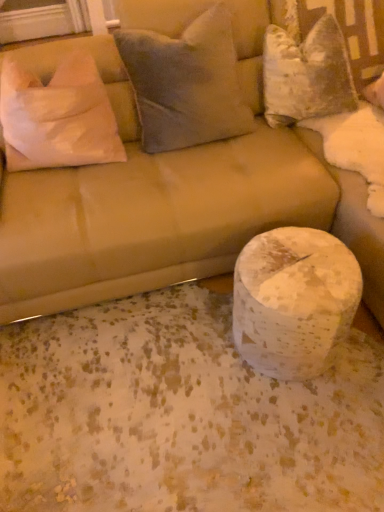
This screenshot has height=512, width=384. I want to click on white fabric pillow at left, marked as the third pillow in a right-to-left arrangement, so click(x=58, y=116).

Locate an element on the screen. white speckled marble at lower right is located at coordinates (294, 301).

Is white speckled marble at lower right thinner than velvety gray pillow at upper center, placed as the 2th pillow when sorted from left to right?

Yes, white speckled marble at lower right is thinner than velvety gray pillow at upper center, placed as the 2th pillow when sorted from left to right.

I want to click on marble that is under the velvety gray pillow at upper center, which is the 2th pillow from right to left (from a real-world perspective), so click(x=294, y=301).

Which object is positioned more to the left, white speckled marble at lower right or velvety gray pillow at upper center, placed as the 2th pillow when sorted from left to right?

velvety gray pillow at upper center, placed as the 2th pillow when sorted from left to right.

Is point (310, 359) positioned behind point (164, 73)?

That is False.

At what (x,y) coordinates should I click in order to perform the action: click on marble that is behind the suede beige couch at center. Please return your answer as a coordinate pair (x, y). Looking at the image, I should click on (294, 301).

Considering the sizes of objects suede beige couch at center and white speckled marble at lower right in the image provided, who is taller, suede beige couch at center or white speckled marble at lower right?

Standing taller between the two is suede beige couch at center.

Considering the sizes of objects suede beige couch at center and white speckled marble at lower right in the image provided, who is smaller, suede beige couch at center or white speckled marble at lower right?

white speckled marble at lower right is smaller.

Which object is positioned more to the right, suede beige couch at center or white speckled marble at lower right?

white speckled marble at lower right.

Visually, is white fabric pillow at left, marked as the third pillow in a right-to-left arrangement, positioned to the left or to the right of velvet white pillow at upper right, the third pillow when ordered from left to right?

white fabric pillow at left, marked as the third pillow in a right-to-left arrangement, is to the left of velvet white pillow at upper right, the third pillow when ordered from left to right.

Which point is more distant from viewer, (65, 156) or (323, 93)?

Positioned behind is point (323, 93).

Is white fabric pillow at left, marked as the third pillow in a right-to-left arrangement, aimed at suede beige couch at center?

Yes, white fabric pillow at left, marked as the third pillow in a right-to-left arrangement, faces towards suede beige couch at center.

From a real-world perspective, is white fabric pillow at left, marked as the third pillow in a right-to-left arrangement, below suede beige couch at center?

Incorrect, from a real-world perspective, white fabric pillow at left, marked as the third pillow in a right-to-left arrangement, is higher than suede beige couch at center.

Can you tell me how much white fabric pillow at left, which ranks as the first pillow in left-to-right order, and suede beige couch at center differ in facing direction?

4.41 degrees separate the facing orientations of white fabric pillow at left, which ranks as the first pillow in left-to-right order, and suede beige couch at center.

Looking at this image, from the image's perspective, would you say white speckled marble at lower right is positioned over velvet white pillow at upper right, positioned as the first pillow in right-to-left order?

No, from the image's perspective, white speckled marble at lower right is not on top of velvet white pillow at upper right, positioned as the first pillow in right-to-left order.

Is white speckled marble at lower right positioned with its back to velvet white pillow at upper right, positioned as the first pillow in right-to-left order?

white speckled marble at lower right does not have its back to velvet white pillow at upper right, positioned as the first pillow in right-to-left order.

In the scene shown: Considering the sizes of objects white speckled marble at lower right and velvet white pillow at upper right, positioned as the first pillow in right-to-left order, in the image provided, who is shorter, white speckled marble at lower right or velvet white pillow at upper right, positioned as the first pillow in right-to-left order,?

white speckled marble at lower right.

The image size is (384, 512). Find the location of `pillow lying on the right of white speckled marble at lower right`. pillow lying on the right of white speckled marble at lower right is located at coordinates (306, 72).

Between velvety gray pillow at upper center, which is the 2th pillow from right to left, and white speckled marble at lower right, which one is positioned behind?

velvety gray pillow at upper center, which is the 2th pillow from right to left, is behind.

From the picture: Do you think velvety gray pillow at upper center, placed as the 2th pillow when sorted from left to right, is within white speckled marble at lower right, or outside of it?

velvety gray pillow at upper center, placed as the 2th pillow when sorted from left to right, is not inside white speckled marble at lower right, it's outside.

Is white fabric pillow at left, which ranks as the first pillow in left-to-right order, positioned far away from velvety gray pillow at upper center, placed as the 2th pillow when sorted from left to right?

white fabric pillow at left, which ranks as the first pillow in left-to-right order, is near velvety gray pillow at upper center, placed as the 2th pillow when sorted from left to right, not far away.

Considering the positions of points (103, 147) and (153, 114), is point (103, 147) closer to camera compared to point (153, 114)?

That is True.

From the image's perspective, is white fabric pillow at left, marked as the third pillow in a right-to-left arrangement, located above or below velvety gray pillow at upper center, placed as the 2th pillow when sorted from left to right?

Based on their image positions, white fabric pillow at left, marked as the third pillow in a right-to-left arrangement, is located beneath velvety gray pillow at upper center, placed as the 2th pillow when sorted from left to right.

Choose the correct answer: Is white fabric pillow at left, marked as the third pillow in a right-to-left arrangement, inside velvety gray pillow at upper center, placed as the 2th pillow when sorted from left to right, or outside it?

white fabric pillow at left, marked as the third pillow in a right-to-left arrangement, is outside velvety gray pillow at upper center, placed as the 2th pillow when sorted from left to right.

In the image, there is a velvety gray pillow at upper center, which is the 2th pillow from right to left. Where is `marble below it (from the image's perspective)`? The image size is (384, 512). marble below it (from the image's perspective) is located at coordinates (294, 301).

At what (x,y) coordinates should I click in order to perform the action: click on marble below the suede beige couch at center (from a real-world perspective). Please return your answer as a coordinate pair (x, y). Looking at the image, I should click on (294, 301).

Estimate the real-world distances between objects in this image. Which object is closer to white fabric pillow at left, which ranks as the first pillow in left-to-right order, suede beige couch at center or white speckled marble at lower right?

The object closer to white fabric pillow at left, which ranks as the first pillow in left-to-right order, is suede beige couch at center.

Which object lies nearer to the anchor point velvety gray pillow at upper center, which is the 2th pillow from right to left, white speckled marble at lower right or white fabric pillow at left, marked as the third pillow in a right-to-left arrangement?

white fabric pillow at left, marked as the third pillow in a right-to-left arrangement, lies closer to velvety gray pillow at upper center, which is the 2th pillow from right to left, than the other object.

Looking at the image, which one is located closer to suede beige couch at center, white speckled marble at lower right or velvet white pillow at upper right, positioned as the first pillow in right-to-left order?

velvet white pillow at upper right, positioned as the first pillow in right-to-left order, is closer to suede beige couch at center.

Considering their positions, is white fabric pillow at left, which ranks as the first pillow in left-to-right order, positioned further to velvety gray pillow at upper center, placed as the 2th pillow when sorted from left to right, than suede beige couch at center?

white fabric pillow at left, which ranks as the first pillow in left-to-right order, is further to velvety gray pillow at upper center, placed as the 2th pillow when sorted from left to right.

When comparing their distances from suede beige couch at center, does white speckled marble at lower right or white fabric pillow at left, marked as the third pillow in a right-to-left arrangement, seem further?

Based on the image, white speckled marble at lower right appears to be further to suede beige couch at center.

Considering their positions, is suede beige couch at center positioned closer to white speckled marble at lower right than white fabric pillow at left, marked as the third pillow in a right-to-left arrangement?

suede beige couch at center.

Considering their positions, is white speckled marble at lower right positioned closer to velvet white pillow at upper right, the third pillow when ordered from left to right, than suede beige couch at center?

The object closer to velvet white pillow at upper right, the third pillow when ordered from left to right, is suede beige couch at center.

Which object lies further to the anchor point velvety gray pillow at upper center, placed as the 2th pillow when sorted from left to right, suede beige couch at center or white fabric pillow at left, which ranks as the first pillow in left-to-right order?

white fabric pillow at left, which ranks as the first pillow in left-to-right order, is positioned further to the anchor velvety gray pillow at upper center, placed as the 2th pillow when sorted from left to right.

You are a GUI agent. You are given a task and a screenshot of the screen. Output one action in this format:
    pyautogui.click(x=<x>, y=<y>)
    Task: Click on the pillow located between white fabric pillow at left, which ranks as the first pillow in left-to-right order, and velvet white pillow at upper right, the third pillow when ordered from left to right, in the left-right direction
    The width and height of the screenshot is (384, 512).
    Given the screenshot: What is the action you would take?
    coord(186,83)

The height and width of the screenshot is (512, 384). In order to click on studio couch that lies between velvety gray pillow at upper center, placed as the 2th pillow when sorted from left to right, and white speckled marble at lower right from top to bottom in this screenshot , I will do `click(172, 197)`.

Find the location of a particular element. The height and width of the screenshot is (512, 384). studio couch between white fabric pillow at left, marked as the third pillow in a right-to-left arrangement, and white speckled marble at lower right from left to right is located at coordinates (172, 197).

Locate an element on the screen. pillow between velvety gray pillow at upper center, which is the 2th pillow from right to left, and white speckled marble at lower right from top to bottom is located at coordinates (58, 116).